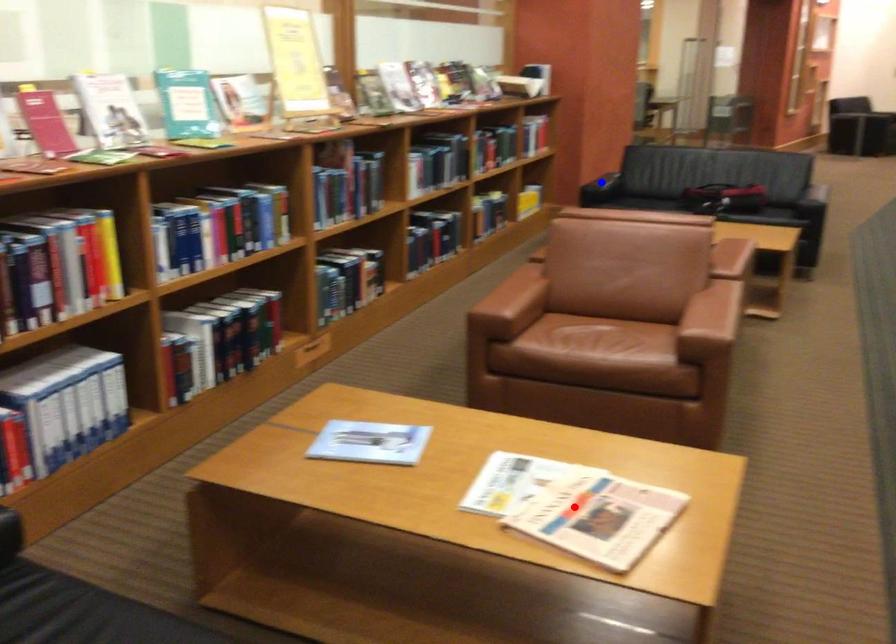
Question: Which of the two points in the image is closer to the camera?

Choices:
 (A) Blue point is closer.
 (B) Red point is closer.

Answer: (B)